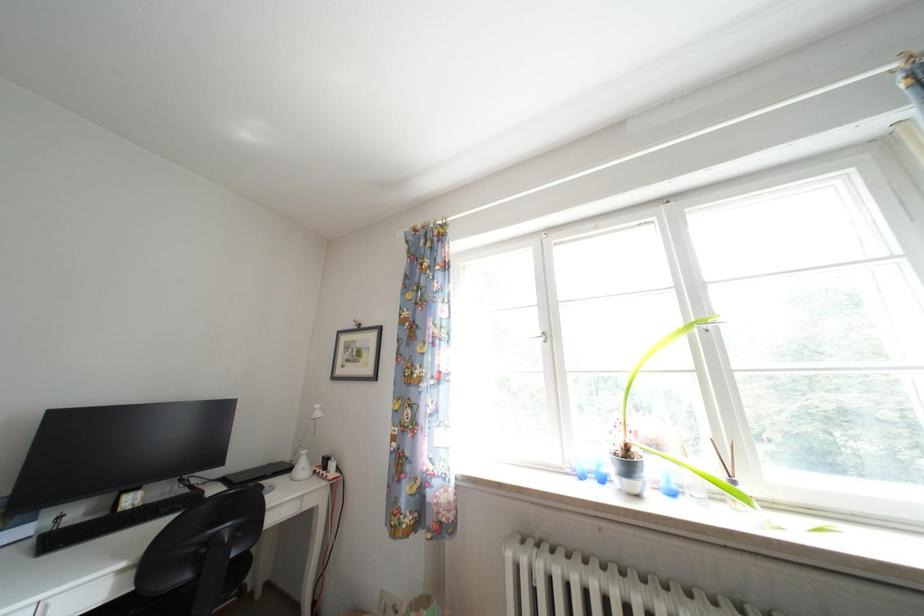
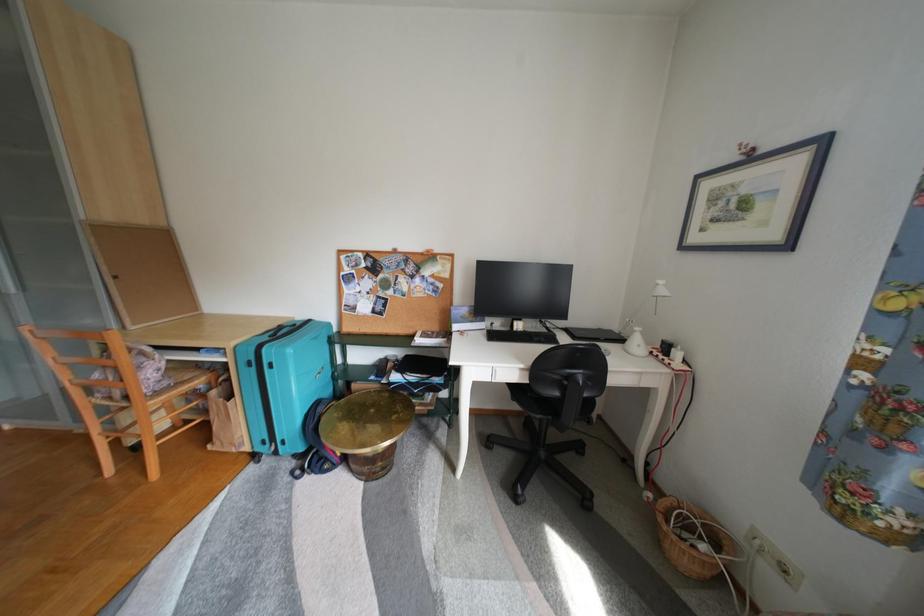
How did the camera likely rotate?

The camera's rotation is toward left-down.